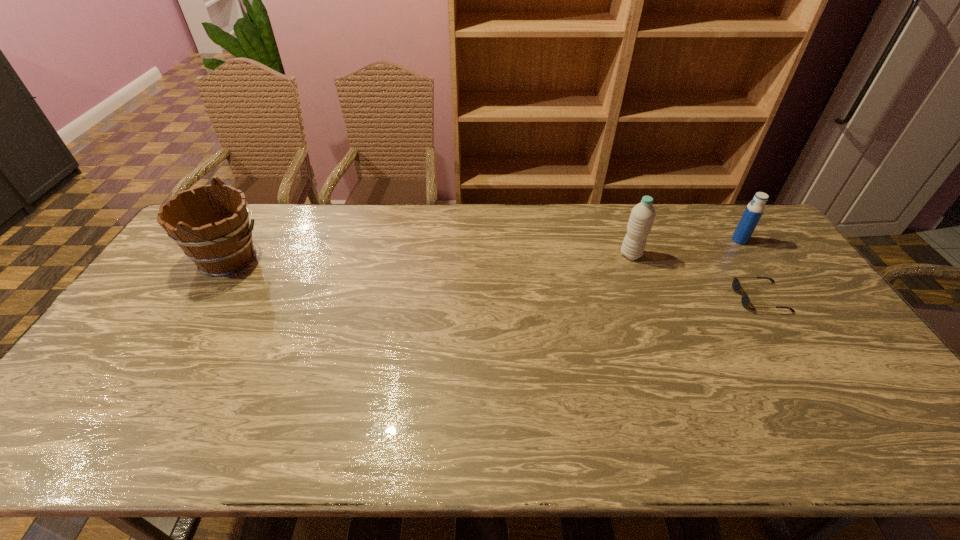
Locate an element on the screen. This screenshot has height=540, width=960. vacant region at the near edge of the desktop is located at coordinates (278, 432).

You are a GUI agent. You are given a task and a screenshot of the screen. Output one action in this format:
    pyautogui.click(x=<x>, y=<y>)
    Task: Click on the vacant space at the left edge
    
    Given the screenshot: What is the action you would take?
    pyautogui.click(x=110, y=360)

Identify the location of free point at the right edge. (864, 389).

What are the coordinates of `free space at the near left corner` in the screenshot? It's located at (76, 453).

The image size is (960, 540). Identify the location of vacant region at the far right corner of the desktop. (749, 244).

This screenshot has width=960, height=540. In the image, there is a desktop. Find the location of `vacant region at the near right corner`. vacant region at the near right corner is located at coordinates (855, 434).

I want to click on free space that is in between the second shortest object and the wine bucket, so click(484, 249).

At what (x,y) coordinates should I click in order to perform the action: click on free point between the sunglasses and the taller water bottle. Please return your answer as a coordinate pair (x, y). The image size is (960, 540). Looking at the image, I should click on (696, 276).

Where is `free spot between the shortest object and the right water bottle`? free spot between the shortest object and the right water bottle is located at coordinates (750, 269).

At what (x,y) coordinates should I click in order to perform the action: click on free point between the shorter water bottle and the left water bottle. Please return your answer as a coordinate pair (x, y). Image resolution: width=960 pixels, height=540 pixels. Looking at the image, I should click on (685, 247).